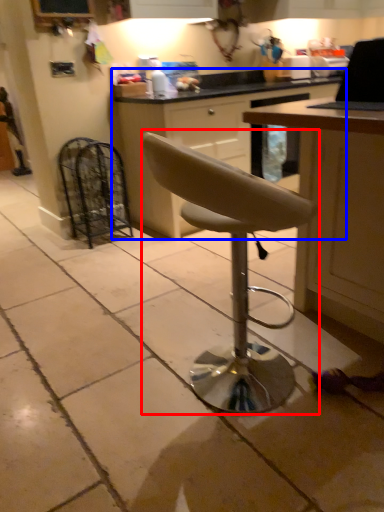
Question: Which object is closer to the camera taking this photo, chair (highlighted by a red box) or cabinetry (highlighted by a blue box)?

Choices:
 (A) chair
 (B) cabinetry

Answer: (A)